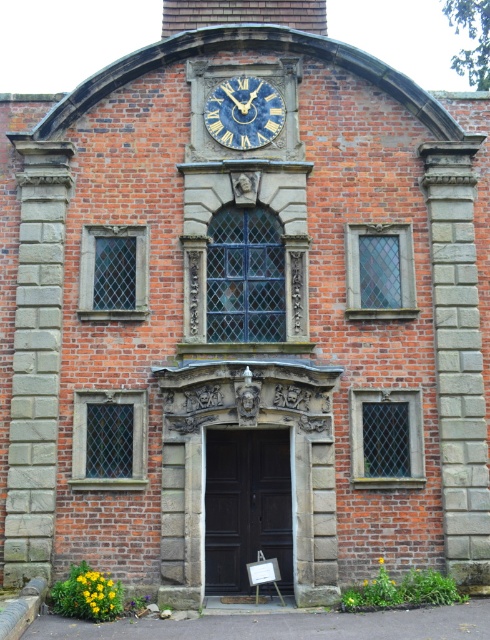
Question: Which of the following is the farthest from the observer?

Choices:
 (A) blue-golden clock at upper center
 (B) dark wood door at center

Answer: (A)

Question: Can you confirm if dark wood door at center is thinner than blue-golden clock at upper center?

Choices:
 (A) yes
 (B) no

Answer: (B)

Question: Can you confirm if dark wood door at center is positioned above blue-golden clock at upper center?

Choices:
 (A) no
 (B) yes

Answer: (A)

Question: Is dark wood door at center above blue-golden clock at upper center?

Choices:
 (A) no
 (B) yes

Answer: (A)